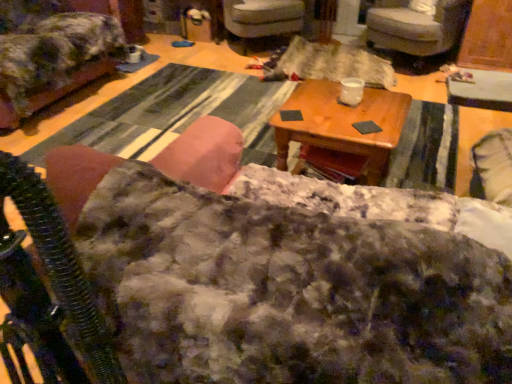
Describe the element at coordinates (204, 154) in the screenshot. I see `fuzzy fabric rocking chair at left` at that location.

What is the approximate height of fuzzy fabric rocking chair at left?

It is 33.70 inches.

What do you see at coordinates (417, 32) in the screenshot?
I see `velvet gray armchair at upper right, placed as the third chair when sorted from left to right` at bounding box center [417, 32].

Measure the distance between velvet gray armchair at center, positioned as the second chair in left-to-right order, and camera.

The depth of velvet gray armchair at center, positioned as the second chair in left-to-right order, is 3.67 meters.

What do you see at coordinates (342, 124) in the screenshot? The width and height of the screenshot is (512, 384). I see `wooden table at center` at bounding box center [342, 124].

The width and height of the screenshot is (512, 384). I want to click on fluffy fabric couch at center, so click(x=284, y=288).

Is fluffy fabric couch at center closer to camera compared to fluffy fabric chair at upper left, placed as the 1th chair when sorted from left to right?

Yes.

From a real-world perspective, is fluffy fabric couch at center located higher than fluffy fabric chair at upper left, which ranks as the third chair in right-to-left order?

Indeed, from a real-world perspective, fluffy fabric couch at center stands above fluffy fabric chair at upper left, which ranks as the third chair in right-to-left order.

Locate an element on the screen. This screenshot has height=384, width=512. couch that is in front of the fluffy fabric chair at upper left, which ranks as the third chair in right-to-left order is located at coordinates (284, 288).

Measure the distance between fluffy fabric couch at center and fluffy fabric chair at upper left, placed as the 1th chair when sorted from left to right.

fluffy fabric couch at center is 8.43 feet from fluffy fabric chair at upper left, placed as the 1th chair when sorted from left to right.

Is velvet gray armchair at upper right, which is the 1th chair from right to left, smaller than wooden table at center?

Actually, velvet gray armchair at upper right, which is the 1th chair from right to left, might be larger than wooden table at center.

Is velvet gray armchair at upper right, which is the 1th chair from right to left, far away from wooden table at center?

Yes, velvet gray armchair at upper right, which is the 1th chair from right to left, and wooden table at center are located far from each other.

Is velvet gray armchair at upper right, which is the 1th chair from right to left, wider or thinner than wooden table at center?

velvet gray armchair at upper right, which is the 1th chair from right to left, is wider than wooden table at center.

Is velvet gray armchair at upper right, which is the 1th chair from right to left, directly adjacent to fluffy fabric couch at center?

No, velvet gray armchair at upper right, which is the 1th chair from right to left, is not next to fluffy fabric couch at center.

Between velvet gray armchair at upper right, placed as the third chair when sorted from left to right, and fluffy fabric couch at center, which one has less height?

With less height is velvet gray armchair at upper right, placed as the third chair when sorted from left to right.

Does velvet gray armchair at upper right, which is the 1th chair from right to left, have a smaller size compared to fluffy fabric couch at center?

Yes.

Could you tell me if fluffy fabric couch at center is turned towards fuzzy fabric rocking chair at left?

No, fluffy fabric couch at center is not turned towards fuzzy fabric rocking chair at left.

Which point is more forward, (x=440, y=268) or (x=187, y=130)?

Positioned in front is point (x=440, y=268).

In the scene shown: From a real-world perspective, which object stands above the other?

In real-world perspective, fuzzy fabric rocking chair at left is above.

Between fluffy fabric couch at center and fuzzy fabric rocking chair at left, which one has smaller width?

fuzzy fabric rocking chair at left is thinner.

Is wooden table at center surrounded by fuzzy fabric rocking chair at left?

No, wooden table at center is not inside fuzzy fabric rocking chair at left.

The image size is (512, 384). I want to click on table that appears above the fuzzy fabric rocking chair at left (from the image's perspective), so click(x=342, y=124).

Does fuzzy fabric rocking chair at left appear on the right side of wooden table at center?

No.

Are fuzzy fabric rocking chair at left and wooden table at center beside each other?

fuzzy fabric rocking chair at left and wooden table at center are clearly separated.

From a real-world perspective, is fluffy fabric couch at center over velvet gray armchair at upper right, placed as the third chair when sorted from left to right?

Yes.

Can you confirm if fluffy fabric couch at center is bigger than velvet gray armchair at upper right, placed as the third chair when sorted from left to right?

Indeed, fluffy fabric couch at center has a larger size compared to velvet gray armchair at upper right, placed as the third chair when sorted from left to right.

Is fluffy fabric couch at center to the left or to the right of velvet gray armchair at upper right, which is the 1th chair from right to left, in the image?

In the image, fluffy fabric couch at center appears on the left side of velvet gray armchair at upper right, which is the 1th chair from right to left.

Choose the correct answer: Is fluffy fabric couch at center inside velvet gray armchair at upper right, which is the 1th chair from right to left, or outside it?

fluffy fabric couch at center is spatially situated outside velvet gray armchair at upper right, which is the 1th chair from right to left.

Locate an element on the screen. rocking chair to the left of velvet gray armchair at upper right, which is the 1th chair from right to left is located at coordinates (204, 154).

Is fuzzy fabric rocking chair at left at the back of velvet gray armchair at upper right, placed as the third chair when sorted from left to right?

velvet gray armchair at upper right, placed as the third chair when sorted from left to right, is not turned away from fuzzy fabric rocking chair at left.

Does velvet gray armchair at upper right, placed as the third chair when sorted from left to right, lie behind fuzzy fabric rocking chair at left?

Yes, velvet gray armchair at upper right, placed as the third chair when sorted from left to right, is further from the camera.

At what (x,y) coordinates should I click in order to perform the action: click on the 2nd chair to the left when counting from the fluffy fabric couch at center. Please return your answer as a coordinate pair (x, y). This screenshot has height=384, width=512. Looking at the image, I should click on (55, 55).

Identify the location of the 2nd chair positioned above the wooden table at center (from the image's perspective). (417, 32).

When comparing their distances from fluffy fabric couch at center, does fluffy fabric chair at upper left, which ranks as the third chair in right-to-left order, or velvet gray armchair at upper right, placed as the third chair when sorted from left to right, seem further?

The object further to fluffy fabric couch at center is velvet gray armchair at upper right, placed as the third chair when sorted from left to right.

Looking at the image, which one is located closer to velvet gray armchair at upper right, which is the 1th chair from right to left, fluffy fabric chair at upper left, placed as the 1th chair when sorted from left to right, or fuzzy fabric rocking chair at left?

fluffy fabric chair at upper left, placed as the 1th chair when sorted from left to right.

From the image, which object appears to be farther from fluffy fabric couch at center, velvet gray armchair at center, which is the 2th chair in right-to-left order, or fluffy fabric chair at upper left, placed as the 1th chair when sorted from left to right?

velvet gray armchair at center, which is the 2th chair in right-to-left order, lies further to fluffy fabric couch at center than the other object.

Considering their positions, is velvet gray armchair at center, which is the 2th chair in right-to-left order, positioned closer to wooden table at center than fluffy fabric chair at upper left, which ranks as the third chair in right-to-left order?

fluffy fabric chair at upper left, which ranks as the third chair in right-to-left order, lies closer to wooden table at center than the other object.

Which object lies further to the anchor point fluffy fabric couch at center, wooden table at center or velvet gray armchair at upper right, which is the 1th chair from right to left?

velvet gray armchair at upper right, which is the 1th chair from right to left.

Based on the photo, which object lies nearer to the anchor point fluffy fabric chair at upper left, placed as the 1th chair when sorted from left to right, wooden table at center or velvet gray armchair at upper right, which is the 1th chair from right to left?

wooden table at center is positioned closer to the anchor fluffy fabric chair at upper left, placed as the 1th chair when sorted from left to right.

Based on their spatial positions, is velvet gray armchair at upper right, which is the 1th chair from right to left, or wooden table at center closer to fuzzy fabric rocking chair at left?

wooden table at center lies closer to fuzzy fabric rocking chair at left than the other object.

From the image, which object appears to be nearer to velvet gray armchair at upper right, placed as the third chair when sorted from left to right, fuzzy fabric rocking chair at left or wooden table at center?

The object closer to velvet gray armchair at upper right, placed as the third chair when sorted from left to right, is wooden table at center.

What are the coordinates of `couch located between fuzzy fabric rocking chair at left and velvet gray armchair at center, positioned as the second chair in left-to-right order, in the depth direction` in the screenshot? It's located at (284, 288).

Image resolution: width=512 pixels, height=384 pixels. In order to click on table between fluffy fabric chair at upper left, which ranks as the third chair in right-to-left order, and velvet gray armchair at upper right, placed as the third chair when sorted from left to right in this screenshot , I will do `click(342, 124)`.

Where is `couch between fuzzy fabric rocking chair at left and fluffy fabric chair at upper left, placed as the 1th chair when sorted from left to right, along the z-axis`? The image size is (512, 384). couch between fuzzy fabric rocking chair at left and fluffy fabric chair at upper left, placed as the 1th chair when sorted from left to right, along the z-axis is located at coordinates pyautogui.click(x=284, y=288).

The width and height of the screenshot is (512, 384). In order to click on couch located between fluffy fabric chair at upper left, placed as the 1th chair when sorted from left to right, and wooden table at center in the left-right direction in this screenshot , I will do `click(284, 288)`.